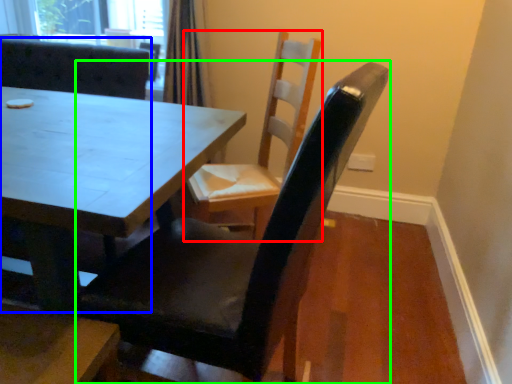
Question: Estimate the real-world distances between objects in this image. Which object is closer to chair (highlighted by a red box), chair (highlighted by a blue box) or chair (highlighted by a green box)?

Choices:
 (A) chair
 (B) chair

Answer: (B)